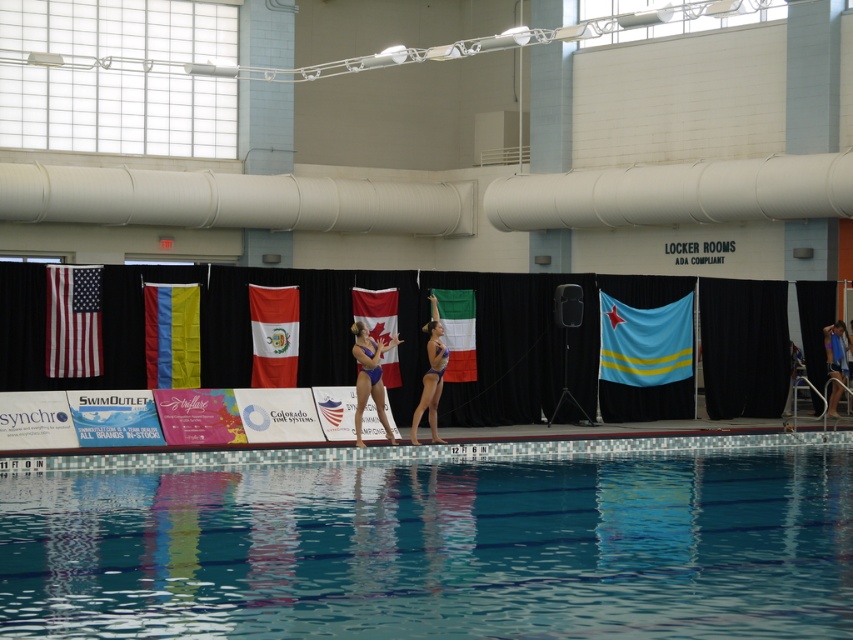
Question: Which point is closer to the camera taking this photo?

Choices:
 (A) (381, 294)
 (B) (161, 310)

Answer: (B)

Question: Is transparent glass pool at center further to the viewer compared to blue glossy swimsuit at center?

Choices:
 (A) no
 (B) yes

Answer: (A)

Question: Among these points, which one is nearest to the camera?

Choices:
 (A) (389, 371)
 (B) (641, 376)
 (C) (67, 284)

Answer: (C)

Question: Which point is closer to the camera?

Choices:
 (A) red and white fabric flag at center
 (B) blue glossy bikini at center
 (C) blue swimsuit at right

Answer: (B)

Question: Considering the relative positions of american flag at left and red and white fabric flag at center in the image provided, where is american flag at left located with respect to red and white fabric flag at center?

Choices:
 (A) left
 (B) right

Answer: (A)

Question: Can you confirm if blue fabric flag at center is smaller than american flag at left?

Choices:
 (A) yes
 (B) no

Answer: (B)